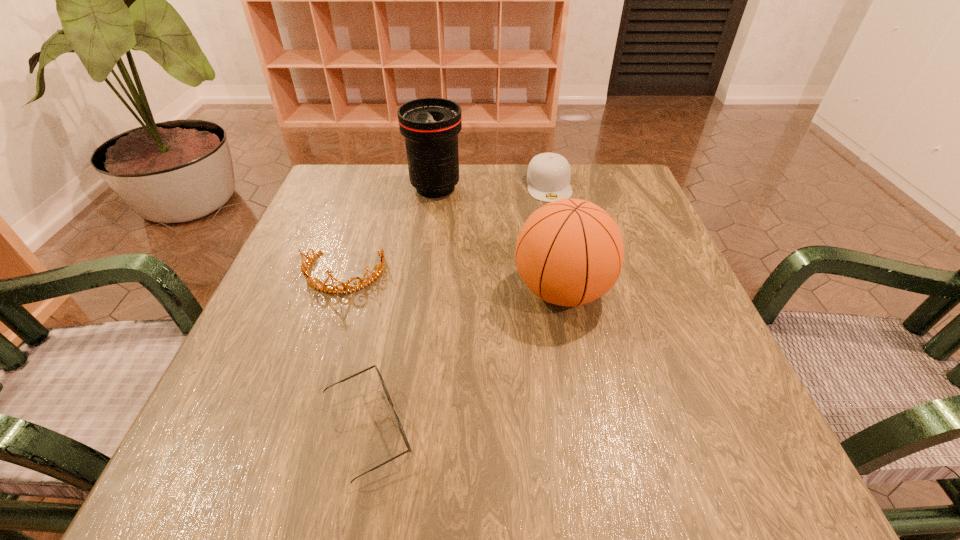
This screenshot has width=960, height=540. I want to click on free space between the tiara and the nearest object, so click(355, 352).

The height and width of the screenshot is (540, 960). I want to click on object identified as the second closest to the cap, so click(569, 252).

I want to click on object that stands as the second closest to the basketball, so click(548, 177).

At what (x,y) coordinates should I click in order to perform the action: click on vacant space that satisfies the following two spatial constraints: 1. on the front-facing side of the basketball; 2. on the right side of the tiara. Please return your answer as a coordinate pair (x, y). The image size is (960, 540). Looking at the image, I should click on (338, 291).

Where is `free spot that satisfies the following two spatial constraints: 1. on the front-facing side of the tiara; 2. on the right side of the basketball`? free spot that satisfies the following two spatial constraints: 1. on the front-facing side of the tiara; 2. on the right side of the basketball is located at coordinates (338, 291).

Locate an element on the screen. This screenshot has width=960, height=540. free spot that satisfies the following two spatial constraints: 1. on the front-facing side of the tiara; 2. on the left side of the basketball is located at coordinates (338, 291).

Identify the location of free space in the image that satisfies the following two spatial constraints: 1. on the front side of the basketball; 2. on the left side of the telephoto lens. The image size is (960, 540). (421, 291).